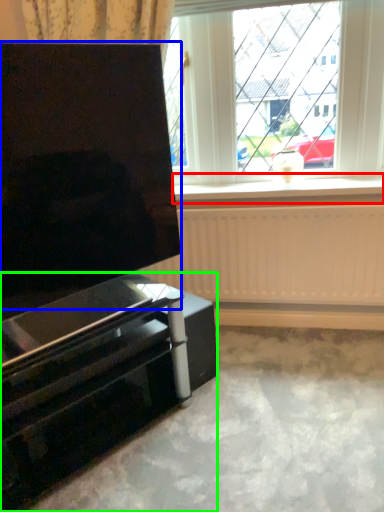
Question: Which is farther away from window sill (highlighted by a red box)? screen (highlighted by a blue box) or furniture (highlighted by a green box)?

Choices:
 (A) screen
 (B) furniture

Answer: (B)